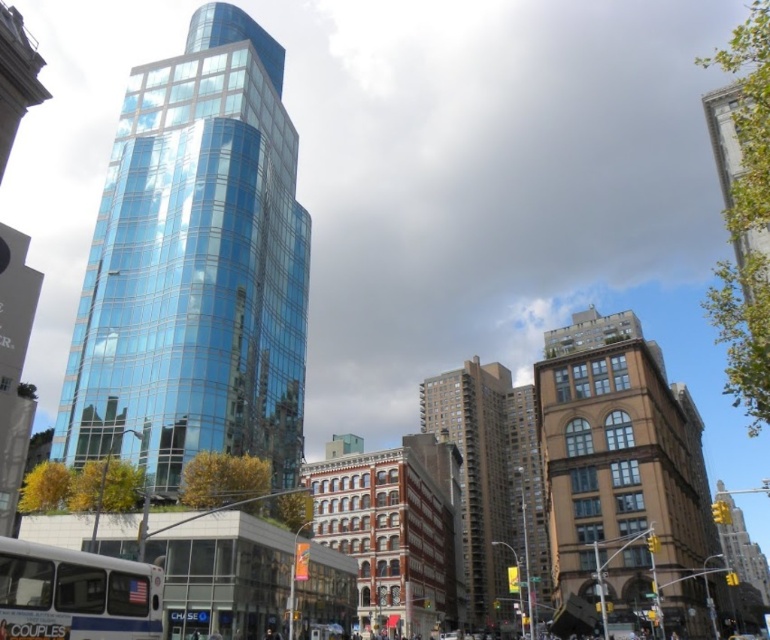
Question: Can you confirm if white matte bus at lower left is wider than metallic silver car at center?

Choices:
 (A) no
 (B) yes

Answer: (A)

Question: Does white matte bus at lower left have a greater width compared to metallic silver car at center?

Choices:
 (A) no
 (B) yes

Answer: (A)

Question: Is white matte bus at lower left positioned behind metallic silver car at center?

Choices:
 (A) yes
 (B) no

Answer: (B)

Question: Which point is farther to the camera?

Choices:
 (A) white matte bus at lower left
 (B) metallic silver car at center

Answer: (B)

Question: Among these objects, which one is nearest to the camera?

Choices:
 (A) white matte bus at lower left
 (B) metallic silver car at center

Answer: (A)